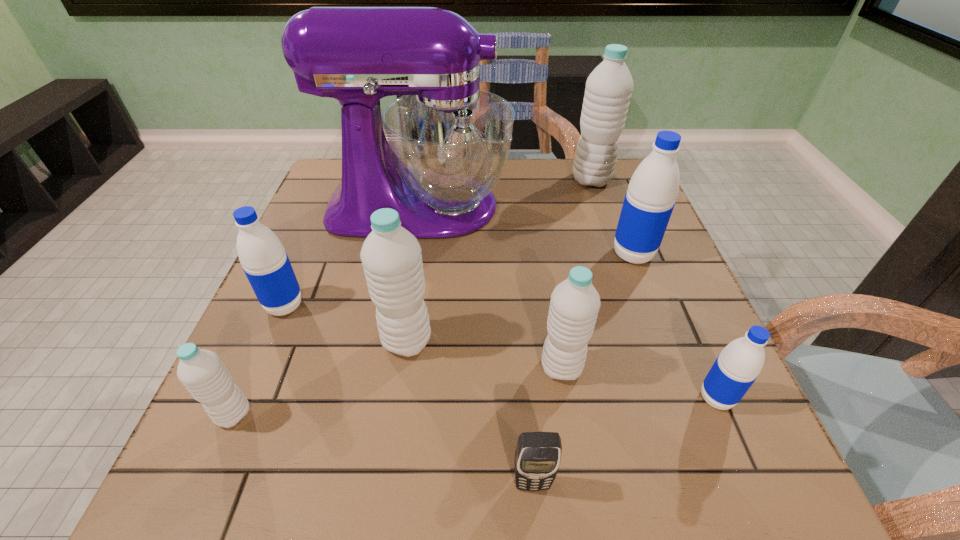
Locate an element on the screen. Image resolution: width=960 pixels, height=540 pixels. the second farthest blue water bottle is located at coordinates (266, 264).

Identify the location of the leftmost blue water bottle. (266, 264).

Image resolution: width=960 pixels, height=540 pixels. Identify the location of the nearest blue water bottle. (737, 367).

Find the location of a particular element. This screenshot has width=960, height=540. the nearest white water bottle is located at coordinates (202, 372).

You are a GUI agent. You are given a task and a screenshot of the screen. Output one action in this format:
    pyautogui.click(x=<x>, y=<y>)
    Task: Click on the smallest white water bottle
    
    Given the screenshot: What is the action you would take?
    pyautogui.click(x=202, y=372)

Where is `the nearest object`? the nearest object is located at coordinates (538, 454).

Find the location of a particular element. The height and width of the screenshot is (540, 960). cellular telephone is located at coordinates (538, 454).

At what (x,y) coordinates should I click in order to perform the action: click on free region located at the bowl opening of the tallest object. Please return your answer as a coordinate pair (x, y). Looking at the image, I should click on (551, 207).

In order to click on vacant space located 0.300m on the left of the biggest white water bottle in this screenshot , I will do `click(468, 180)`.

Locate an element on the screen. The height and width of the screenshot is (540, 960). free spot located on the front of the biggest blue water bottle is located at coordinates (678, 373).